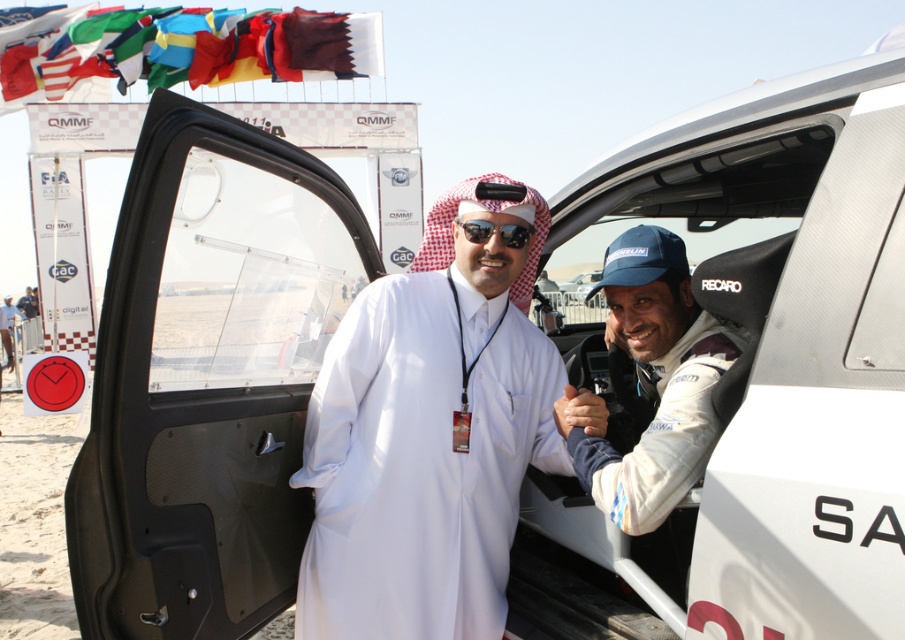
You are a photographer at the event and need to capture both the white matte robe at center and the white leather racing suit at center in a single frame. Given their sizes, which clothing item will appear wider in the photo?

The white matte robe at center will appear wider in the photo since its width is larger than that of the white leather racing suit at center.

You are a photographer at the event and need to capture a clear photo of both the white matte robe at center and the sunglasses at center. Given their height difference, which object should you focus on first to ensure both are in frame?

The white matte robe at center is much taller than the sunglasses at center, so you should focus on the white matte robe at center first to ensure both are in frame.

You are standing in the desert and see two points marked in the scene. Which point, point (691, 348) or point (492, 227), is closer to you?

Point (691, 348) is closer to the viewer than point (492, 227).